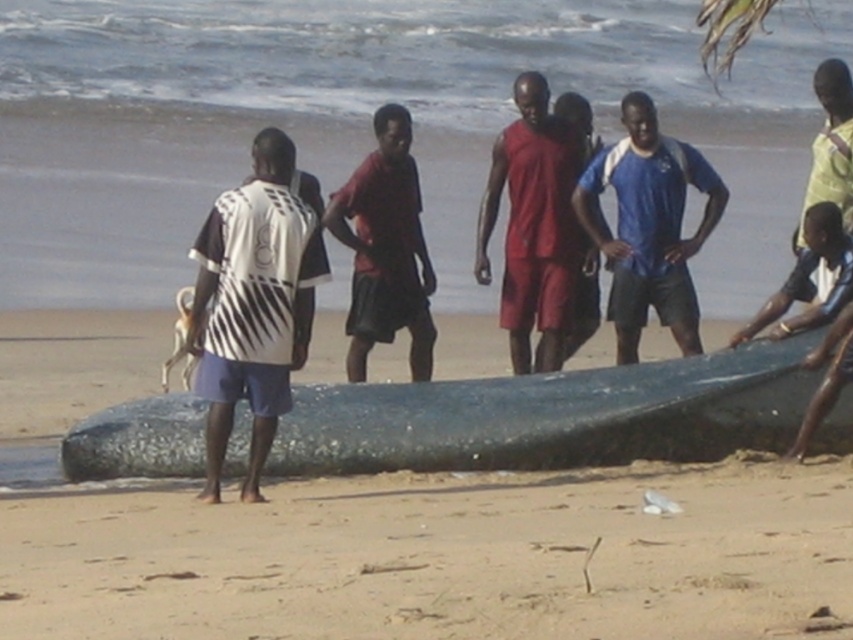
Is shiny dark blue boat at center to the left of blue jersey at center from the viewer's perspective?

Correct, you'll find shiny dark blue boat at center to the left of blue jersey at center.

Can you confirm if shiny dark blue boat at center is positioned above blue jersey at center?

Actually, shiny dark blue boat at center is below blue jersey at center.

Is point (531, 390) positioned before point (643, 264)?

Yes, point (531, 390) is closer to viewer.

Find the location of a particular element. shiny dark blue boat at center is located at coordinates (554, 416).

What do you see at coordinates (253, 305) in the screenshot? Image resolution: width=853 pixels, height=640 pixels. I see `white striped shirt at center` at bounding box center [253, 305].

Between point (254, 291) and point (642, 140), which one is positioned behind?

The point (642, 140) is more distant.

Is point (276, 196) more distant than point (613, 148)?

No.

Where is `white striped shirt at center`? This screenshot has height=640, width=853. white striped shirt at center is located at coordinates (253, 305).

In the scene shown: Between shiny dark blue boat at center and white striped shirt at center, which one appears on the left side from the viewer's perspective?

white striped shirt at center is more to the left.

Where is `shiny dark blue boat at center`? The image size is (853, 640). shiny dark blue boat at center is located at coordinates (554, 416).

Is point (791, 420) farther from viewer compared to point (223, 330)?

Yes, point (791, 420) is behind point (223, 330).

What are the coordinates of `shiny dark blue boat at center` in the screenshot? It's located at (554, 416).